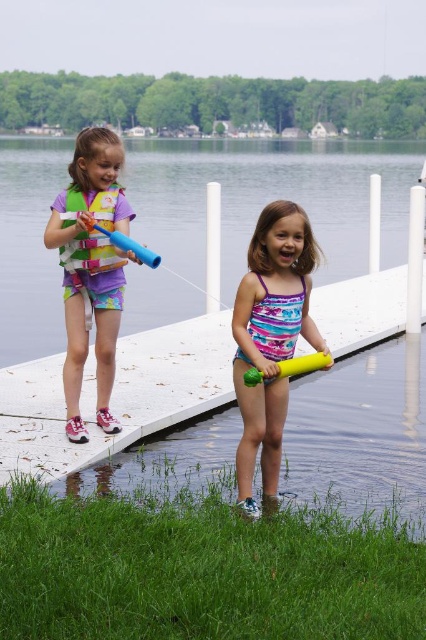
Question: From the image, what is the correct spatial relationship of matte purple shorts at left in relation to yellow rubber tube at lower center?

Choices:
 (A) left
 (B) right

Answer: (A)

Question: Which object is positioned closest to the matte yellow float at center?

Choices:
 (A) yellow rubber tube at lower center
 (B) blue rubber tube at upper left

Answer: (A)

Question: Is matte yellow float at center below blue rubber tube at upper left?

Choices:
 (A) yes
 (B) no

Answer: (A)

Question: Can you confirm if matte yellow float at center is positioned to the left of yellow rubber tube at lower center?

Choices:
 (A) no
 (B) yes

Answer: (A)

Question: Based on their relative distances, which object is farther from the blue rubber tube at upper left?

Choices:
 (A) matte yellow float at center
 (B) transparent plastic water at center
 (C) matte purple shorts at left
 (D) yellow rubber tube at lower center

Answer: (B)

Question: Which object is farther from the camera taking this photo?

Choices:
 (A) matte purple shorts at left
 (B) blue rubber tube at upper left
 (C) yellow rubber tube at lower center

Answer: (A)